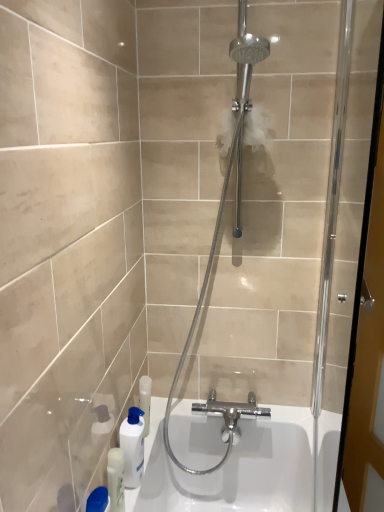
Question: Is there a large distance between white glossy bottle at lower left and polished chrome shower head at center?

Choices:
 (A) yes
 (B) no

Answer: (B)

Question: From a real-world perspective, is white glossy bottle at lower left physically above polished chrome shower head at center?

Choices:
 (A) no
 (B) yes

Answer: (A)

Question: Is polished chrome shower head at center at the back of white glossy bottle at lower left?

Choices:
 (A) yes
 (B) no

Answer: (B)

Question: Is white glossy bottle at lower left next to polished chrome shower head at center?

Choices:
 (A) no
 (B) yes

Answer: (A)

Question: Is the position of white glossy bottle at lower left more distant than that of polished chrome shower head at center?

Choices:
 (A) yes
 (B) no

Answer: (A)

Question: In terms of width, does white glossy bottle at lower left look wider or thinner when compared to polished chrome shower head at center?

Choices:
 (A) thin
 (B) wide

Answer: (A)

Question: Considering their positions, is white glossy bottle at lower left located in front of or behind polished chrome shower head at center?

Choices:
 (A) front
 (B) behind

Answer: (B)

Question: Based on their positions, is white glossy bottle at lower left located to the left or right of polished chrome shower head at center?

Choices:
 (A) right
 (B) left

Answer: (B)

Question: Which is correct: white glossy bottle at lower left is inside polished chrome shower head at center, or outside of it?

Choices:
 (A) outside
 (B) inside

Answer: (A)

Question: In terms of width, does white glossy bottle at lower left look wider or thinner when compared to polished chrome shower head at center?

Choices:
 (A) thin
 (B) wide

Answer: (A)

Question: In terms of size, does white glossy bottle at lower left appear bigger or smaller than polished chrome shower head at center?

Choices:
 (A) big
 (B) small

Answer: (B)

Question: Visually, is white glossy bottle at lower left positioned to the left or to the right of polished chrome shower head at center?

Choices:
 (A) right
 (B) left

Answer: (B)

Question: Would you say white glossy bottle at lower left is inside or outside polished chrome shower head at center?

Choices:
 (A) inside
 (B) outside

Answer: (B)

Question: Relative to white glossy bottle at lower left, is white glossy bottle at lower left in front or behind?

Choices:
 (A) front
 (B) behind

Answer: (A)

Question: Do you think white glossy bottle at lower left is within white glossy bottle at lower left, or outside of it?

Choices:
 (A) outside
 (B) inside

Answer: (A)